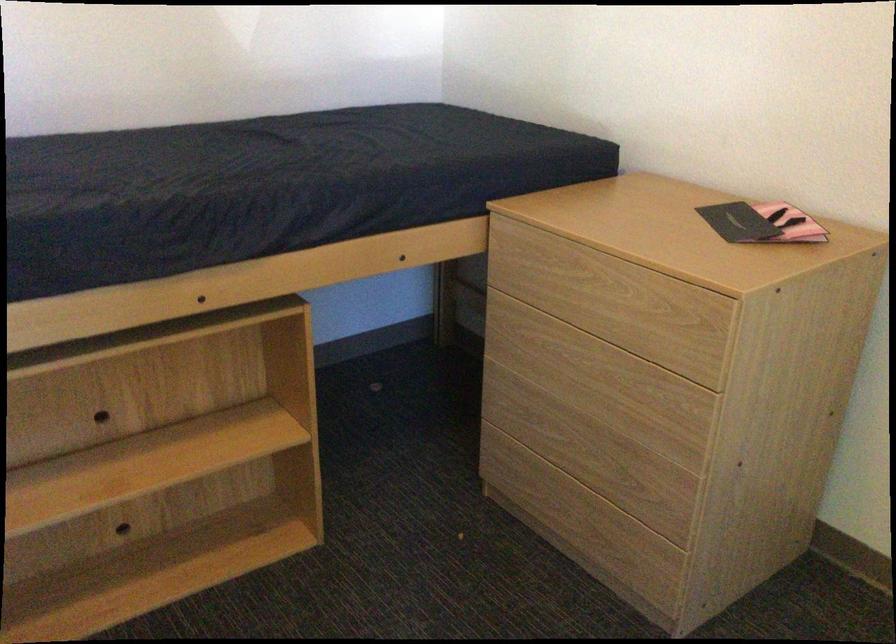
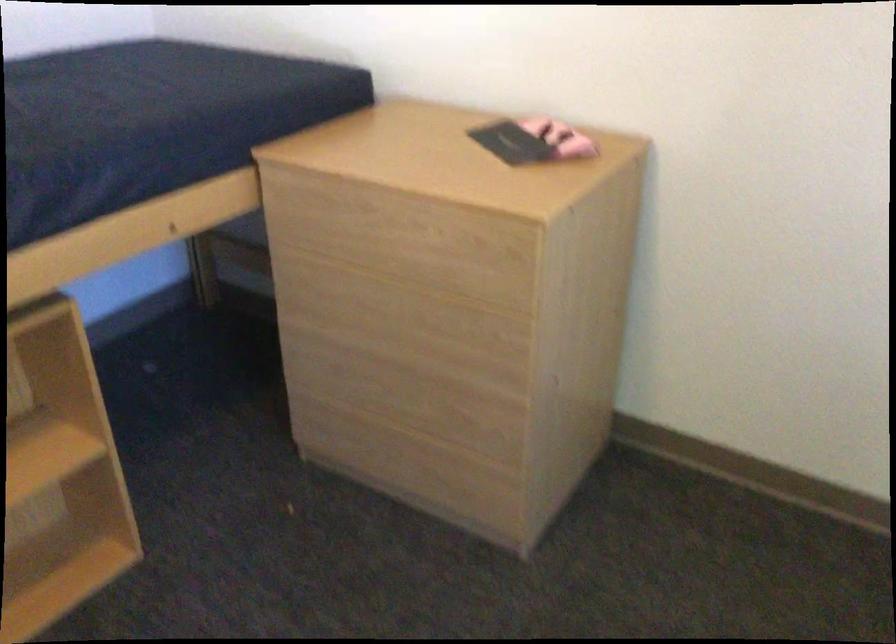
In a continuous first-person perspective shot, in which direction is the camera moving?

The cameraman walked toward left, forward.